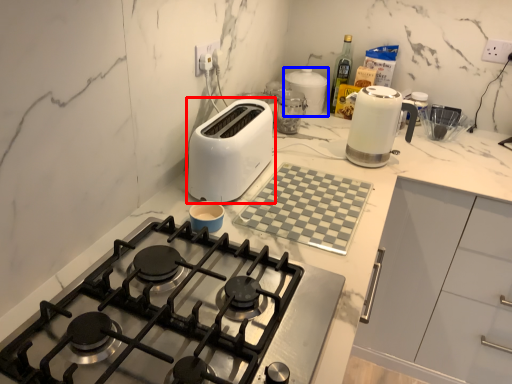
Question: Which object appears farthest to the camera in this image, toaster (highlighted by a red box) or kitchen appliance (highlighted by a blue box)?

Choices:
 (A) toaster
 (B) kitchen appliance

Answer: (B)